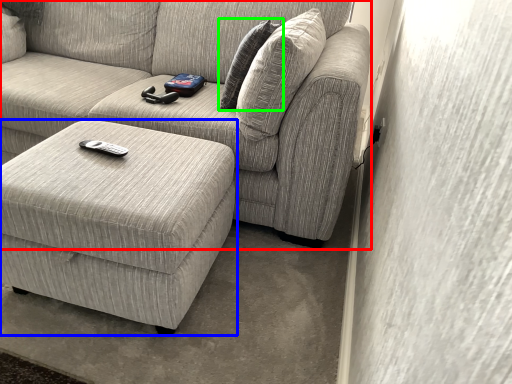
Question: Considering the real-world distances, which object is closest to studio couch (highlighted by a red box)? table (highlighted by a blue box) or pillow (highlighted by a green box).

Choices:
 (A) table
 (B) pillow

Answer: (B)